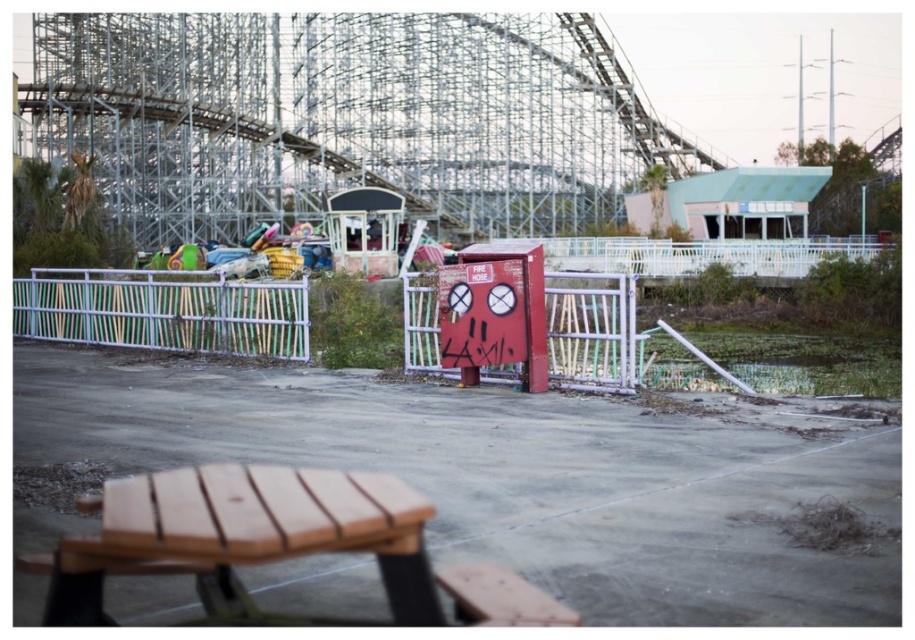
Between rusty metal gate at center and rusty metal fire hose box at center, which one is positioned higher?

rusty metal fire hose box at center

Can you confirm if rusty metal gate at center is positioned to the right of rusty metal fire hose box at center?

Yes, rusty metal gate at center is to the right of rusty metal fire hose box at center.

Is point (636, 346) positioned in front of point (540, 384)?

Yes.

Where is `rusty metal gate at center`? This screenshot has height=640, width=915. rusty metal gate at center is located at coordinates (591, 332).

Is wooden picnic table at lower center below rusty metal fire hose box at center?

Yes.

Does point (92, 609) come in front of point (475, 262)?

Yes, it is.

The image size is (915, 640). In order to click on wooden picnic table at lower center in this screenshot , I will do `click(243, 534)`.

Who is more forward, (160, 492) or (106, 275)?

Point (160, 492)

Which is above, wooden picnic table at lower center or white painted wood fence at left?

Positioned higher is white painted wood fence at left.

Does point (70, 605) come behind point (48, 305)?

No, (70, 605) is in front of (48, 305).

Locate an element on the screen. The width and height of the screenshot is (915, 640). wooden picnic table at lower center is located at coordinates (243, 534).